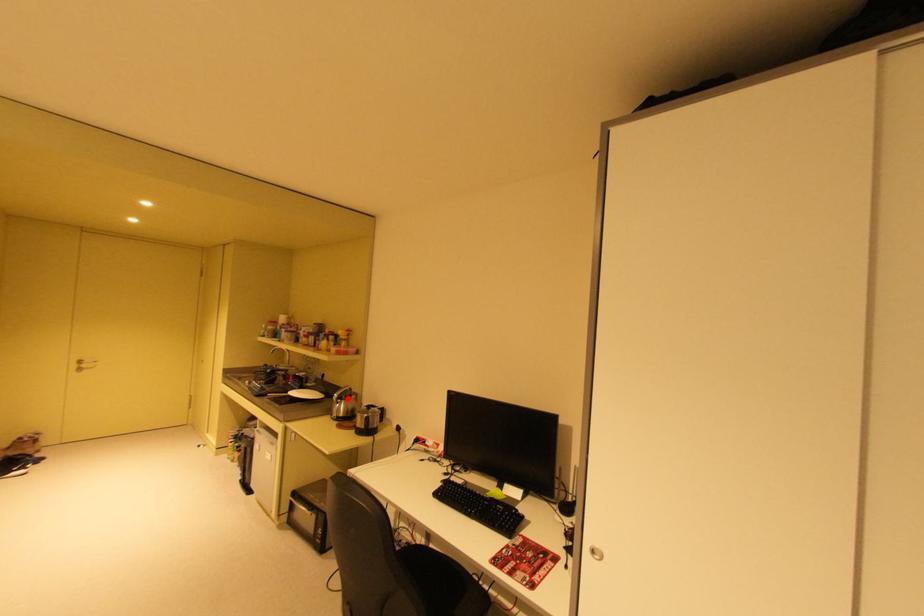
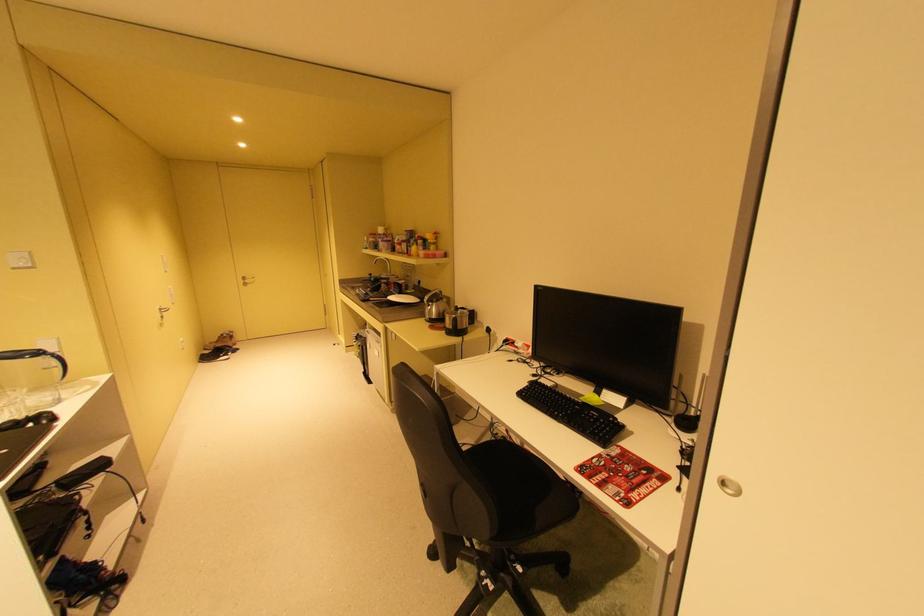
The point at the highlighted location is marked in the first image. Where is the corresponding point in the second image?

(439, 302)